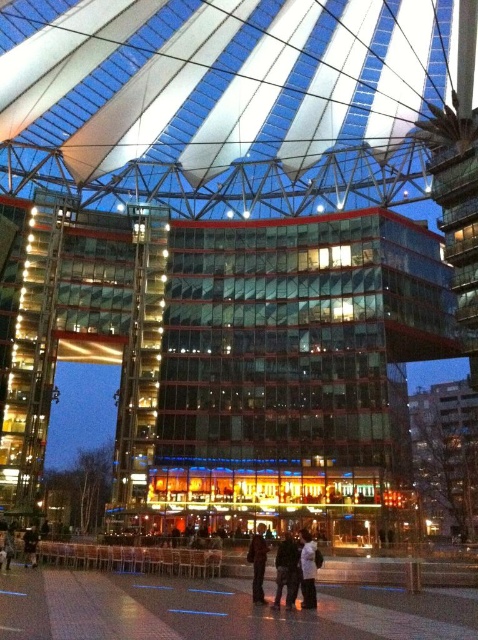
You are standing at the base of the building and looking up. You notice two points marked on the structure. One is at point coordinates (382, 115) and the other at (33, 547). Which point is closer to your line of sight?

Point (33, 547) is closer to your line of sight because it is in front of point (382, 115).

Looking at this image, you are standing at the entrance of the building and notice the transparent fabric canopy at center and the dark blue jeans at lower left. Which object is positioned to the right side of the other?

The transparent fabric canopy at center is to the right of dark blue jeans at lower left.

You are a fashion designer observing the modern architectural structure. You notice a white matte jacket at center and dark blue jeans at lower left in the scene. Which clothing item appears bigger in the image?

The white matte jacket at center is larger in size than the dark blue jeans at lower left, so the white matte jacket at center appears bigger in the image.